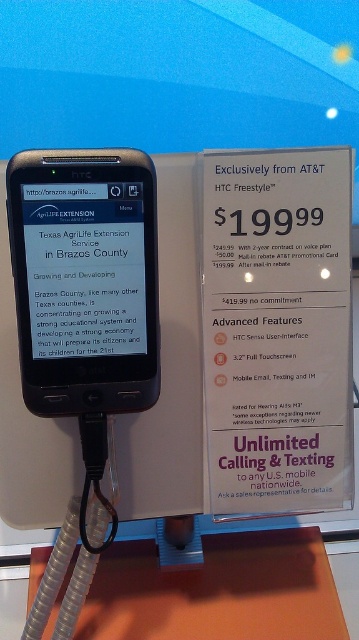
Between point (31, 312) and point (236, 598), which one is positioned in front?

Point (31, 312) is more forward.

Does matte black phone at center have a larger size compared to orange matte table at lower center?

No, matte black phone at center is not bigger than orange matte table at lower center.

Is point (151, 397) behind point (333, 604)?

No, (151, 397) is in front of (333, 604).

Find the location of a particular element. Image resolution: width=359 pixels, height=640 pixels. matte black phone at center is located at coordinates click(x=85, y=280).